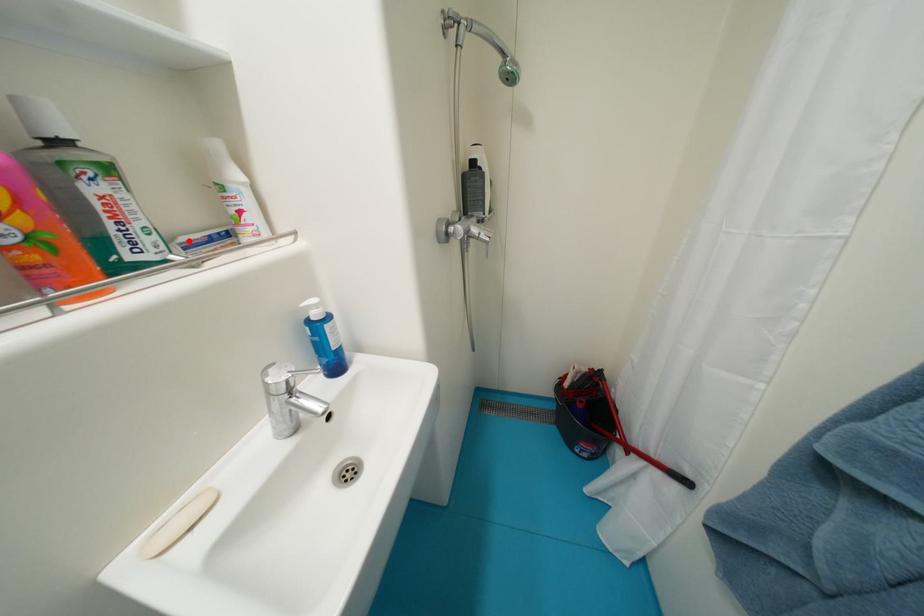
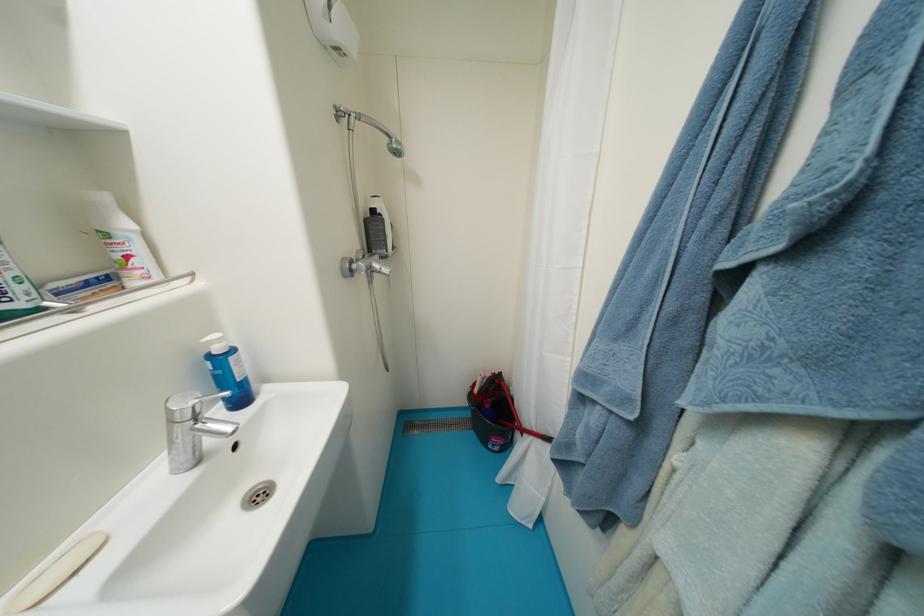
In the second image, find the point that corresponds to the highlighted location in the first image.

(61, 286)